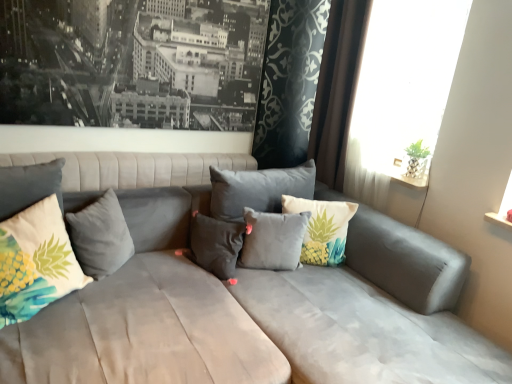
This screenshot has width=512, height=384. I want to click on printed fabric pineapple pillow at left, placed as the 1th pillow when sorted from left to right, so click(x=35, y=262).

Image resolution: width=512 pixels, height=384 pixels. What do you see at coordinates (246, 300) in the screenshot? I see `suede gray couch at center` at bounding box center [246, 300].

Describe the element at coordinates (132, 63) in the screenshot. I see `black matte picture frame at upper left` at that location.

Describe the element at coordinates (100, 236) in the screenshot. I see `gray velvet pillow at center, the 4th pillow positioned from the right` at that location.

What do you see at coordinates (337, 88) in the screenshot? This screenshot has width=512, height=384. I see `brown velvet curtain at upper right` at bounding box center [337, 88].

Where is `printed fabric pineapple pillow at left, placed as the 1th pillow when sorted from left to right`? This screenshot has height=384, width=512. printed fabric pineapple pillow at left, placed as the 1th pillow when sorted from left to right is located at coordinates (35, 262).

What's the angular difference between printed fabric pineapple pillow at left, placed as the 1th pillow when sorted from left to right, and black matte picture frame at upper left's facing directions?

The angle between the facing direction of printed fabric pineapple pillow at left, placed as the 1th pillow when sorted from left to right, and the facing direction of black matte picture frame at upper left is 0.818 degrees.

Is printed fabric pineapple pillow at left, placed as the 1th pillow when sorted from left to right, aimed at black matte picture frame at upper left?

No, printed fabric pineapple pillow at left, placed as the 1th pillow when sorted from left to right, is not turned towards black matte picture frame at upper left.

Which object is wider, printed fabric pineapple pillow at left, marked as the 5th pillow in a right-to-left arrangement, or black matte picture frame at upper left?

printed fabric pineapple pillow at left, marked as the 5th pillow in a right-to-left arrangement.

Which of these two, printed fabric pineapple pillow at left, marked as the 5th pillow in a right-to-left arrangement, or black matte picture frame at upper left, is smaller?

Smaller between the two is printed fabric pineapple pillow at left, marked as the 5th pillow in a right-to-left arrangement.

From the image's perspective, which one is positioned higher, white sheer curtain at upper right or gray velvet pillow at center, positioned as the second pillow in left-to-right order?

white sheer curtain at upper right.

Considering the positions of points (408, 122) and (133, 245), is point (408, 122) farther from camera compared to point (133, 245)?

Yes.

From a real-world perspective, is white sheer curtain at upper right over gray velvet pillow at center, the 4th pillow positioned from the right?

Yes, from a real-world perspective, white sheer curtain at upper right is over gray velvet pillow at center, the 4th pillow positioned from the right

Is white sheer curtain at upper right far from gray velvet pillow at center, positioned as the second pillow in left-to-right order?

white sheer curtain at upper right is far away from gray velvet pillow at center, positioned as the second pillow in left-to-right order.

Does velvet gray pillow at center, placed as the 3th pillow when sorted from left to right, lie in front of suede gray couch at center?

No, velvet gray pillow at center, placed as the 3th pillow when sorted from left to right, is behind suede gray couch at center.

Between velvet gray pillow at center, acting as the 3th pillow starting from the right, and suede gray couch at center, which one has smaller size?

velvet gray pillow at center, acting as the 3th pillow starting from the right, is smaller.

From the image's perspective, between velvet gray pillow at center, placed as the 3th pillow when sorted from left to right, and suede gray couch at center, which one is located above?

velvet gray pillow at center, placed as the 3th pillow when sorted from left to right, appears higher in the image.

Is velvet gray pillow at center, acting as the 3th pillow starting from the right, far away from suede gray couch at center?

No, velvet gray pillow at center, acting as the 3th pillow starting from the right, is in close proximity to suede gray couch at center.

Between pineapple-patterned fabric pillow at center, placed as the 1th pillow when sorted from right to left, and white sheer curtain at upper right, which one has smaller size?

pineapple-patterned fabric pillow at center, placed as the 1th pillow when sorted from right to left.

Which object is thinner, pineapple-patterned fabric pillow at center, placed as the 1th pillow when sorted from right to left, or white sheer curtain at upper right?

white sheer curtain at upper right.

How many degrees apart are the facing directions of pineapple-patterned fabric pillow at center, placed as the 1th pillow when sorted from right to left, and white sheer curtain at upper right?

pineapple-patterned fabric pillow at center, placed as the 1th pillow when sorted from right to left, and white sheer curtain at upper right are facing 89 degrees away from each other.

Considering the points (149, 233) and (92, 223), which point is in front, point (149, 233) or point (92, 223)?

Point (92, 223)

From the picture: Is suede gray couch at center positioned with its back to gray velvet pillow at center, positioned as the second pillow in left-to-right order?

Absolutely, suede gray couch at center is directed away from gray velvet pillow at center, positioned as the second pillow in left-to-right order.

Considering the relative positions of suede gray couch at center and gray velvet pillow at center, positioned as the second pillow in left-to-right order, in the image provided, is suede gray couch at center to the left or to the right of gray velvet pillow at center, positioned as the second pillow in left-to-right order,?

suede gray couch at center is positioned on gray velvet pillow at center, positioned as the second pillow in left-to-right order,'s right side.

Where is `studio couch that appears below the gray velvet pillow at center, positioned as the second pillow in left-to-right order (from the image's perspective)`? This screenshot has width=512, height=384. studio couch that appears below the gray velvet pillow at center, positioned as the second pillow in left-to-right order (from the image's perspective) is located at coordinates (246, 300).

Does black matte picture frame at upper left have a lesser height compared to gray matte pillow at center, which ranks as the fourth pillow in left-to-right order?

No.

Looking at this image, from the image's perspective, is black matte picture frame at upper left on top of gray matte pillow at center, which appears as the second pillow when viewed from the right?

Yes, from the image's perspective, black matte picture frame at upper left is above gray matte pillow at center, which appears as the second pillow when viewed from the right.

Can you confirm if black matte picture frame at upper left is smaller than gray matte pillow at center, which appears as the second pillow when viewed from the right?

Actually, black matte picture frame at upper left might be larger than gray matte pillow at center, which appears as the second pillow when viewed from the right.

Can you tell me how much black matte picture frame at upper left and gray matte pillow at center, which ranks as the fourth pillow in left-to-right order, differ in facing direction?

The facing directions of black matte picture frame at upper left and gray matte pillow at center, which ranks as the fourth pillow in left-to-right order, are 0.818 degrees apart.

Does velvet gray pillow at center, acting as the 3th pillow starting from the right, have a smaller size compared to brown velvet curtain at upper right?

Correct, velvet gray pillow at center, acting as the 3th pillow starting from the right, occupies less space than brown velvet curtain at upper right.

Considering the relative positions of velvet gray pillow at center, acting as the 3th pillow starting from the right, and brown velvet curtain at upper right in the image provided, is velvet gray pillow at center, acting as the 3th pillow starting from the right, to the left of brown velvet curtain at upper right from the viewer's perspective?

Yes.

How distant is velvet gray pillow at center, acting as the 3th pillow starting from the right, from brown velvet curtain at upper right?

velvet gray pillow at center, acting as the 3th pillow starting from the right, is 3.51 feet away from brown velvet curtain at upper right.

From the image's perspective, which pillow is the 4th one below the black matte picture frame at upper left? Please provide its 2D coordinates.

[(35, 262)]

At what (x,y) coordinates should I click in order to perform the action: click on window behind the gray velvet pillow at center, the 4th pillow positioned from the right. Please return your answer as a coordinate pair (x, y). This screenshot has width=512, height=384. Looking at the image, I should click on (404, 82).

When comparing their distances from velvet gray pillow at center, acting as the 3th pillow starting from the right, does black matte picture frame at upper left or pineapple-patterned fabric pillow at center, which is counted as the 5th pillow, starting from the left, seem closer?

The object closer to velvet gray pillow at center, acting as the 3th pillow starting from the right, is pineapple-patterned fabric pillow at center, which is counted as the 5th pillow, starting from the left.

Which object lies further to the anchor point gray velvet pillow at center, positioned as the second pillow in left-to-right order, black matte picture frame at upper left or velvet gray pillow at center, placed as the 3th pillow when sorted from left to right?

black matte picture frame at upper left.

Estimate the real-world distances between objects in this image. Which object is further from brown velvet curtain at upper right, velvet gray pillow at center, acting as the 3th pillow starting from the right, or black matte picture frame at upper left?

velvet gray pillow at center, acting as the 3th pillow starting from the right.

Looking at the image, which one is located further to velvet gray pillow at center, acting as the 3th pillow starting from the right, pineapple-patterned fabric pillow at center, placed as the 1th pillow when sorted from right to left, or suede gray couch at center?

The object further to velvet gray pillow at center, acting as the 3th pillow starting from the right, is pineapple-patterned fabric pillow at center, placed as the 1th pillow when sorted from right to left.

Estimate the real-world distances between objects in this image. Which object is closer to gray matte pillow at center, which appears as the second pillow when viewed from the right, velvet gray pillow at center, placed as the 3th pillow when sorted from left to right, or white sheer curtain at upper right?

velvet gray pillow at center, placed as the 3th pillow when sorted from left to right, lies closer to gray matte pillow at center, which appears as the second pillow when viewed from the right, than the other object.

Based on their spatial positions, is printed fabric pineapple pillow at left, marked as the 5th pillow in a right-to-left arrangement, or velvet gray pillow at center, placed as the 3th pillow when sorted from left to right, closer to pineapple-patterned fabric pillow at center, placed as the 1th pillow when sorted from right to left?

velvet gray pillow at center, placed as the 3th pillow when sorted from left to right, is positioned closer to the anchor pineapple-patterned fabric pillow at center, placed as the 1th pillow when sorted from right to left.

In the scene shown: Based on their spatial positions, is gray matte pillow at center, which ranks as the fourth pillow in left-to-right order, or white sheer curtain at upper right further from gray velvet pillow at center, the 4th pillow positioned from the right?

Based on the image, white sheer curtain at upper right appears to be further to gray velvet pillow at center, the 4th pillow positioned from the right.

Looking at the image, which one is located further to black matte picture frame at upper left, pineapple-patterned fabric pillow at center, placed as the 1th pillow when sorted from right to left, or white sheer curtain at upper right?

Among the two, white sheer curtain at upper right is located further to black matte picture frame at upper left.

Find the location of a particular element. picture frame between gray velvet pillow at center, the 4th pillow positioned from the right, and white sheer curtain at upper right, in the horizontal direction is located at coordinates (132, 63).

At what (x,y) coordinates should I click in order to perform the action: click on pillow between velvet gray pillow at center, placed as the 3th pillow when sorted from left to right, and pineapple-patterned fabric pillow at center, placed as the 1th pillow when sorted from right to left, in the horizontal direction. Please return your answer as a coordinate pair (x, y). Looking at the image, I should click on (273, 240).

I want to click on picture frame between suede gray couch at center and pineapple-patterned fabric pillow at center, placed as the 1th pillow when sorted from right to left, along the z-axis, so click(132, 63).

The height and width of the screenshot is (384, 512). I want to click on picture frame situated between gray velvet pillow at center, positioned as the second pillow in left-to-right order, and pineapple-patterned fabric pillow at center, placed as the 1th pillow when sorted from right to left, from left to right, so click(132, 63).